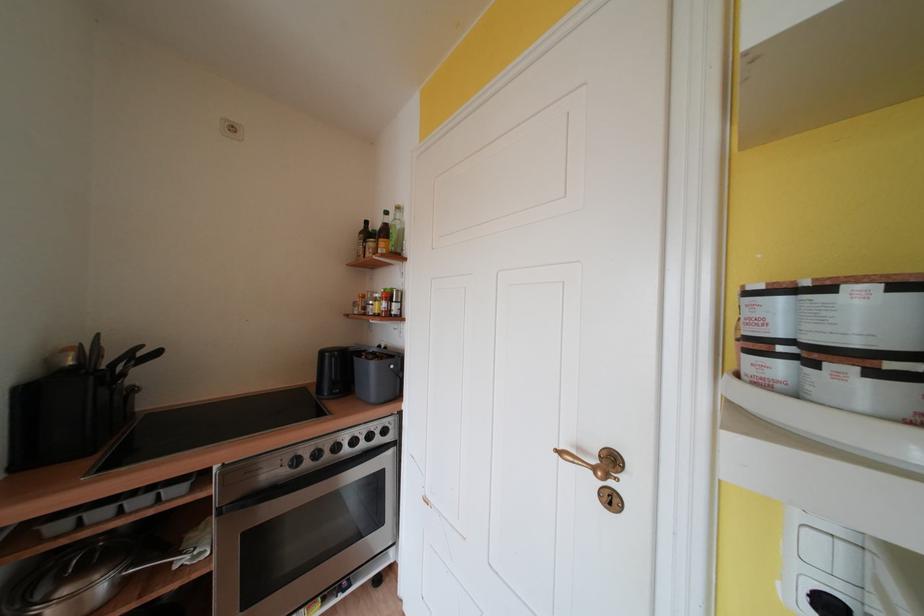
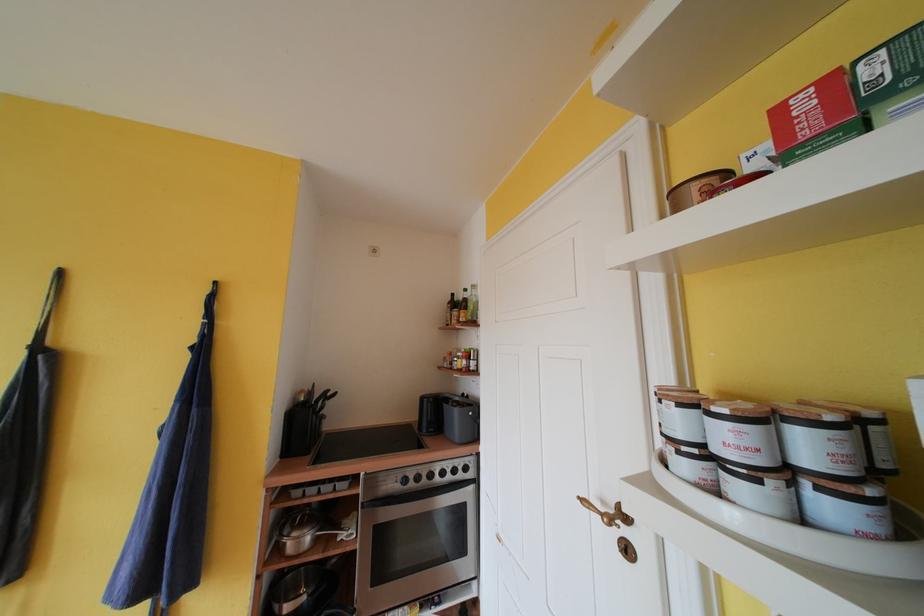
The point at (55, 365) is marked in the first image. Where is the corresponding point in the second image?

(301, 402)